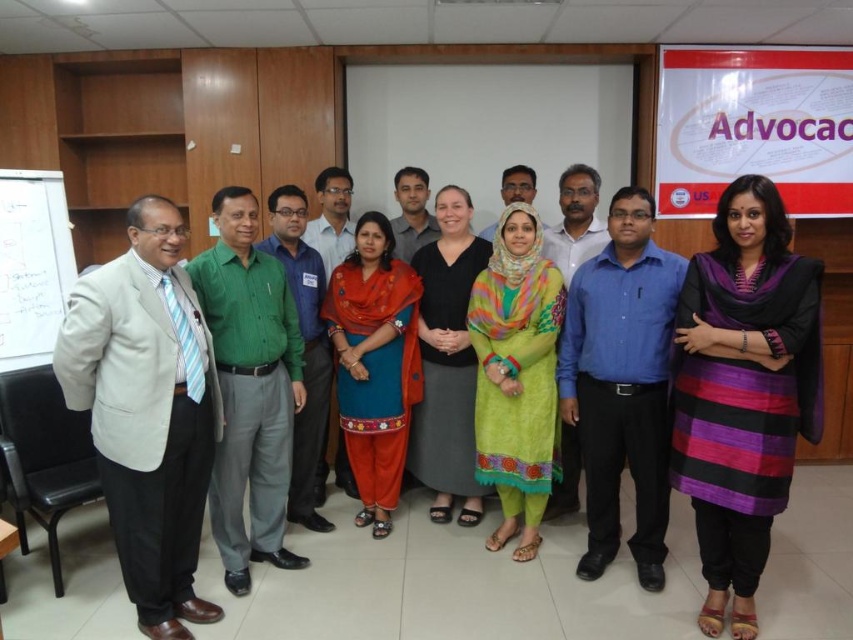
Question: Is purple striped kurti at center bigger than beige fabric suit at left?

Choices:
 (A) no
 (B) yes

Answer: (A)

Question: Which point is farther to the camera?

Choices:
 (A) beige fabric suit at left
 (B) black matte dress at center

Answer: (B)

Question: Is beige fabric suit at left bigger than blue cotton kurta at center?

Choices:
 (A) yes
 (B) no

Answer: (A)

Question: Which object appears farthest from the camera in this image?

Choices:
 (A) whiteboard at left
 (B) black matte dress at center
 (C) green embroidered dress at center

Answer: (A)

Question: Considering the real-world distances, which object is closest to the beige fabric suit at left?

Choices:
 (A) black matte dress at center
 (B) blue cotton kurta at center
 (C) whiteboard at left

Answer: (B)

Question: Can you confirm if blue cotton kurta at center is positioned above whiteboard at left?

Choices:
 (A) yes
 (B) no

Answer: (B)